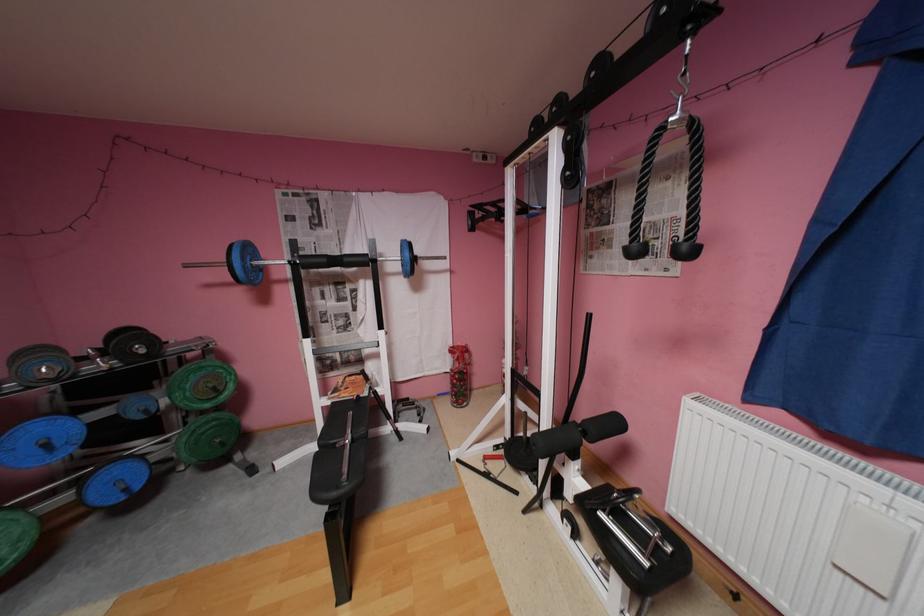
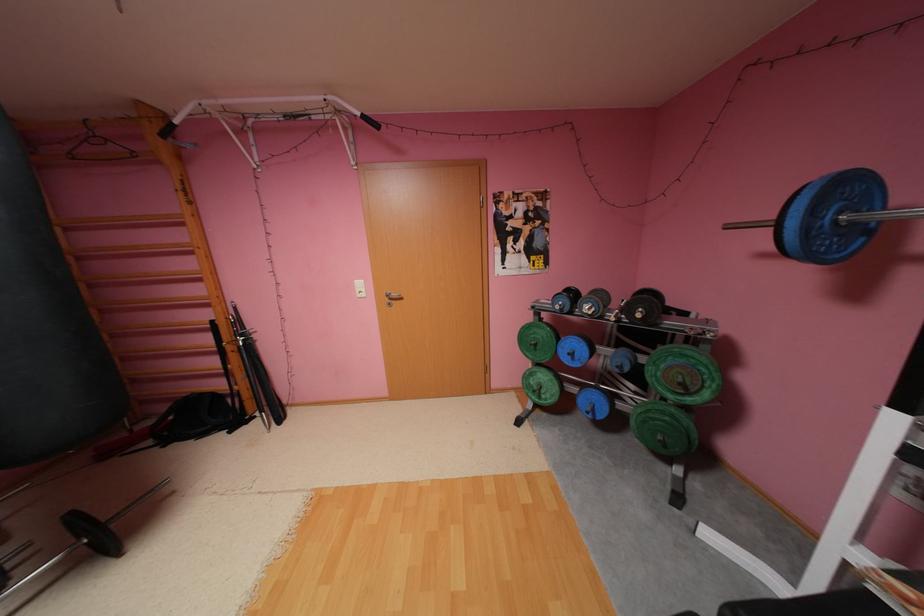
The point at (55, 445) is marked in the first image. Where is the corresponding point in the second image?

(580, 354)